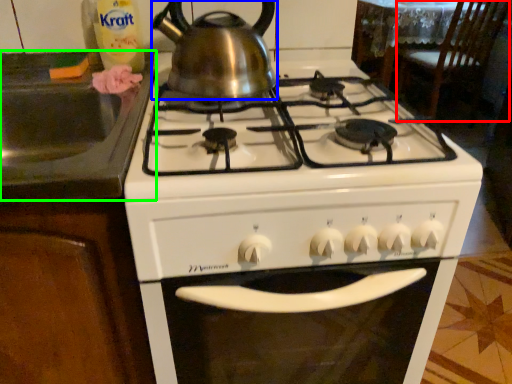
Question: Estimate the real-world distances between objects in this image. Which object is farther from chair (highlighted by a red box), kettle (highlighted by a blue box) or sink (highlighted by a green box)?

Choices:
 (A) kettle
 (B) sink

Answer: (B)